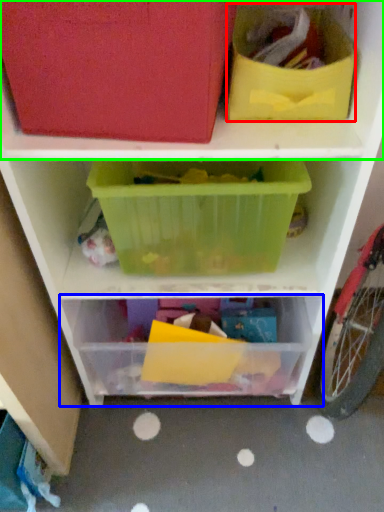
Question: Considering the real-world distances, which object is farthest from storage box (highlighted by a red box)? shelf (highlighted by a blue box) or shelf (highlighted by a green box)?

Choices:
 (A) shelf
 (B) shelf

Answer: (A)